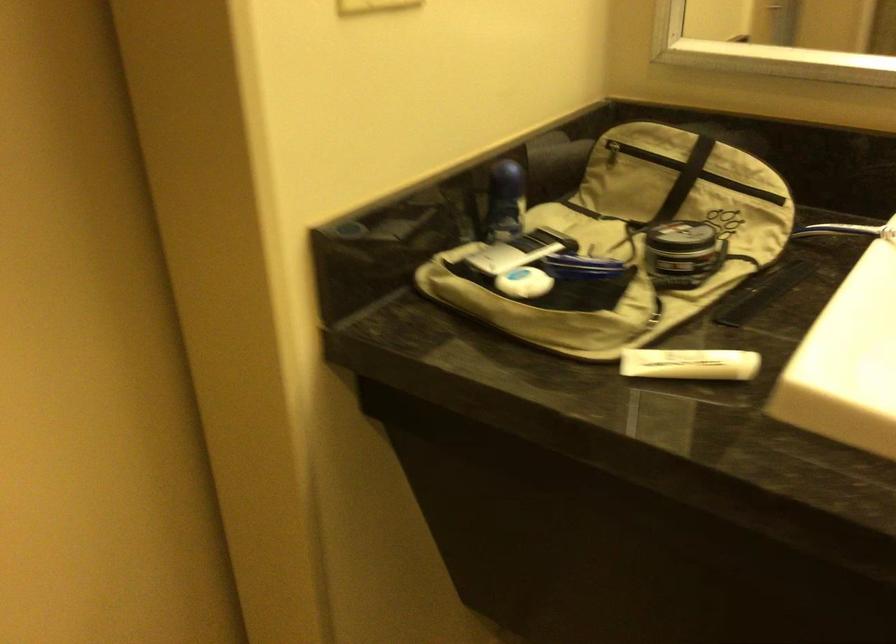
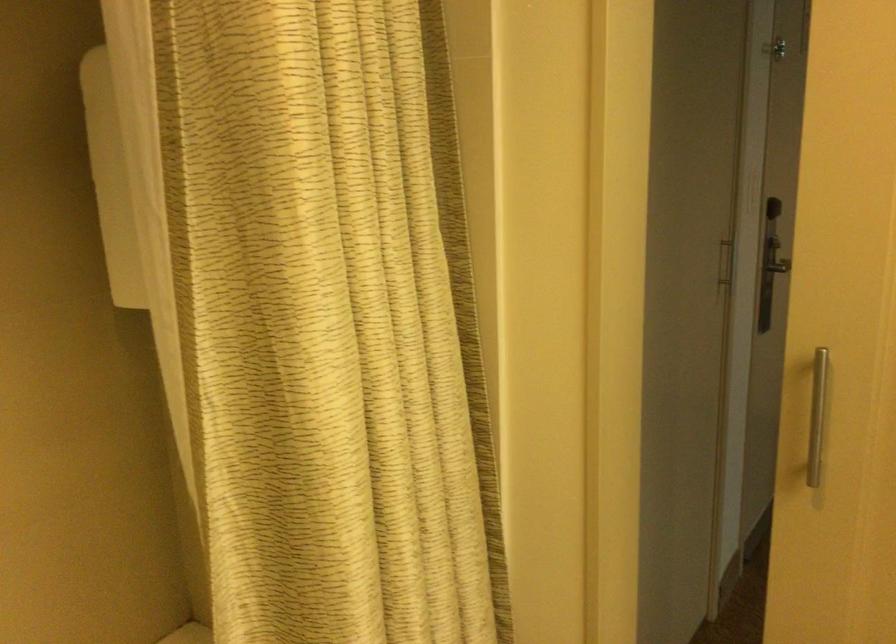
Question: The camera is either moving clockwise (left) or counter-clockwise (right) around the object. The first image is from the beginning of the video and the second image is from the end. Is the camera moving left or right when shooting the video?

Choices:
 (A) Left
 (B) Right

Answer: (B)